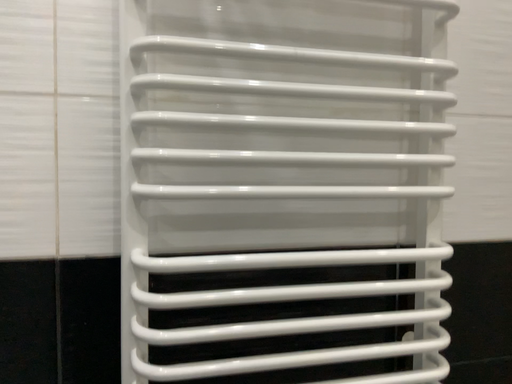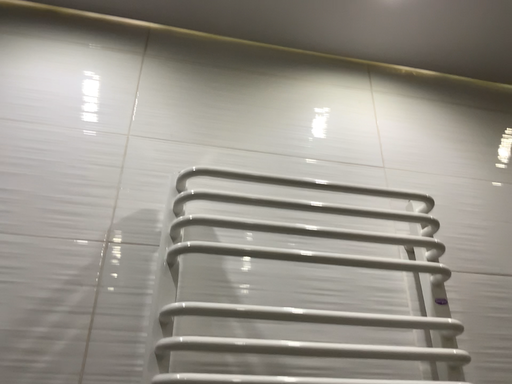
Question: Which way did the camera rotate in the video?

Choices:
 (A) rotated upward
 (B) rotated downward

Answer: (A)